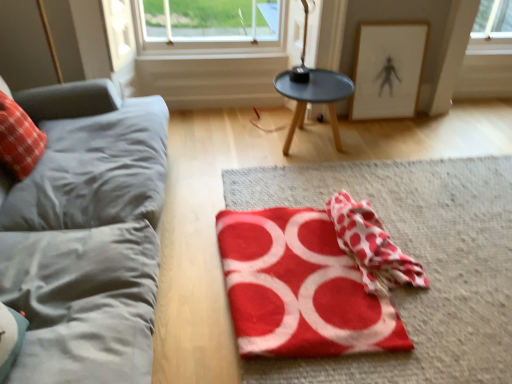
Measure the distance between red plaid throw pillow at left and camera.

A distance of 6.30 feet exists between red plaid throw pillow at left and camera.

At what (x,y) coordinates should I click in order to perform the action: click on black matte table at center. Please return your answer as a coordinate pair (x, y). Looking at the image, I should click on (314, 98).

You are a GUI agent. You are given a task and a screenshot of the screen. Output one action in this format:
    pyautogui.click(x=<x>, y=<y>)
    Task: Click on the red fabric at center
    
    Given the screenshot: What is the action you would take?
    pyautogui.click(x=416, y=258)

Image resolution: width=512 pixels, height=384 pixels. In order to click on red polka dot fabric at center in this screenshot , I will do `click(372, 246)`.

This screenshot has width=512, height=384. I want to click on red plaid throw pillow at left, so click(x=19, y=139).

Who is taller, red felt yoga mat at center or red plaid throw pillow at left?

With more height is red plaid throw pillow at left.

From the image's perspective, is red felt yoga mat at center on top of red plaid throw pillow at left?

No, from the image's perspective, red felt yoga mat at center is not over red plaid throw pillow at left.

In terms of width, does red felt yoga mat at center look wider or thinner when compared to red plaid throw pillow at left?

red felt yoga mat at center is wider than red plaid throw pillow at left.

Does red felt yoga mat at center appear on the left side of red plaid throw pillow at left?

No, red felt yoga mat at center is not to the left of red plaid throw pillow at left.

From the image's perspective, is red fabric at center positioned above or below white paper picture frame at upper right?

Based on their image positions, red fabric at center is located beneath white paper picture frame at upper right.

Is red fabric at center taller or shorter than white paper picture frame at upper right?

red fabric at center is shorter than white paper picture frame at upper right.

Considering the points (400, 306) and (376, 86), which point is in front, point (400, 306) or point (376, 86)?

The point (400, 306) is more forward.

Is red fabric at center located outside white paper picture frame at upper right?

Yes.

Between white paper picture frame at upper right and red polka dot fabric at center, which one has larger width?

Wider between the two is red polka dot fabric at center.

Looking at the image, does white paper picture frame at upper right seem bigger or smaller compared to red polka dot fabric at center?

Clearly, white paper picture frame at upper right is smaller in size than red polka dot fabric at center.

Identify the location of picture frame behind the red polka dot fabric at center. (388, 69).

Is point (347, 253) positioned before point (389, 82)?

Yes.

From a real-world perspective, relative to white paper picture frame at upper right, is red polka dot fabric at center vertically above or below?

From a real-world perspective, red polka dot fabric at center is physically below white paper picture frame at upper right.

I want to click on picture frame that appears above the red polka dot fabric at center (from a real-world perspective), so click(x=388, y=69).

In the image, is red polka dot fabric at center positioned in front of or behind white paper picture frame at upper right?

red polka dot fabric at center is positioned closer to the viewer than white paper picture frame at upper right.

Is red fabric at center not near gray fabric couch at left?

No, there isn't a large distance between red fabric at center and gray fabric couch at left.

Which object is further away from the camera taking this photo, red fabric at center or gray fabric couch at left?

red fabric at center is further away from the camera.

From a real-world perspective, which is physically below, red fabric at center or gray fabric couch at left?

red fabric at center.

Between red fabric at center and gray fabric couch at left, which one appears on the left side from the viewer's perspective?

gray fabric couch at left is more to the left.

In order to click on beach towel below the gray fabric couch at left (from the image's perspective) in this screenshot , I will do `click(372, 246)`.

What's the angular difference between red polka dot fabric at center and gray fabric couch at left's facing directions?

The facing directions of red polka dot fabric at center and gray fabric couch at left are 3.92 degrees apart.

Is red polka dot fabric at center taller than gray fabric couch at left?

No, red polka dot fabric at center is not taller than gray fabric couch at left.

Considering the positions of objects red polka dot fabric at center and gray fabric couch at left in the image provided, who is in front, red polka dot fabric at center or gray fabric couch at left?

gray fabric couch at left is more forward.

Choose the correct answer: Is red plaid throw pillow at left inside black matte table at center or outside it?

red plaid throw pillow at left lies outside black matte table at center.

Can you see red plaid throw pillow at left touching black matte table at center?

No.

Is red plaid throw pillow at left bigger or smaller than black matte table at center?

Clearly, red plaid throw pillow at left is smaller in size than black matte table at center.

Considering the sizes of objects red plaid throw pillow at left and black matte table at center in the image provided, who is shorter, red plaid throw pillow at left or black matte table at center?

black matte table at center is shorter.

At what (x,y) coordinates should I click in order to perform the action: click on yoga mat below the red plaid throw pillow at left (from a real-world perspective). Please return your answer as a coordinate pair (x, y). The height and width of the screenshot is (384, 512). Looking at the image, I should click on (298, 288).

Where is `picture frame behind the red fabric at center`? Image resolution: width=512 pixels, height=384 pixels. picture frame behind the red fabric at center is located at coordinates (388, 69).

Estimate the real-world distances between objects in this image. Which object is further from red fabric at center, gray fabric couch at left or red plaid throw pillow at left?

The object further to red fabric at center is red plaid throw pillow at left.

From the image, which object appears to be nearer to white paper picture frame at upper right, red fabric at center or black matte table at center?

The object closer to white paper picture frame at upper right is black matte table at center.

When comparing their distances from red plaid throw pillow at left, does gray fabric couch at left or white paper picture frame at upper right seem closer?

gray fabric couch at left lies closer to red plaid throw pillow at left than the other object.

Estimate the real-world distances between objects in this image. Which object is further from red fabric at center, white paper picture frame at upper right or red felt yoga mat at center?

white paper picture frame at upper right is further to red fabric at center.

Which object lies nearer to the anchor point gray fabric couch at left, red felt yoga mat at center or red polka dot fabric at center?

Based on the image, red felt yoga mat at center appears to be nearer to gray fabric couch at left.

From the image, which object appears to be farther from white paper picture frame at upper right, black matte table at center or red felt yoga mat at center?

The object further to white paper picture frame at upper right is red felt yoga mat at center.

Based on their spatial positions, is white paper picture frame at upper right or red fabric at center closer to black matte table at center?

Among the two, white paper picture frame at upper right is located nearer to black matte table at center.

Looking at the image, which one is located closer to black matte table at center, red polka dot fabric at center or red felt yoga mat at center?

The object closer to black matte table at center is red polka dot fabric at center.

Where is `beach towel located between red felt yoga mat at center and red fabric at center in the left-right direction`? The height and width of the screenshot is (384, 512). beach towel located between red felt yoga mat at center and red fabric at center in the left-right direction is located at coordinates (372, 246).

Find the location of a particular element. This screenshot has height=384, width=512. beach towel between red felt yoga mat at center and black matte table at center along the z-axis is located at coordinates (372, 246).

I want to click on beach towel between gray fabric couch at left and white paper picture frame at upper right along the z-axis, so click(372, 246).

I want to click on yoga mat positioned between gray fabric couch at left and white paper picture frame at upper right from near to far, so click(298, 288).